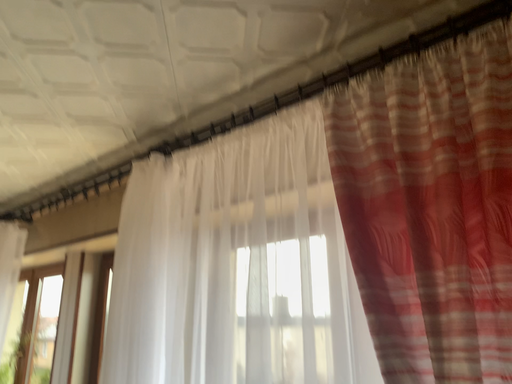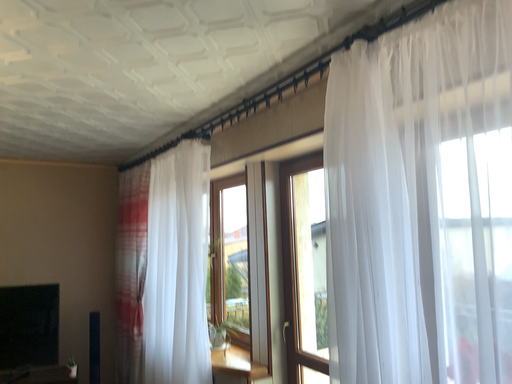
Question: Which way did the camera rotate in the video?

Choices:
 (A) rotated upward
 (B) rotated downward

Answer: (B)